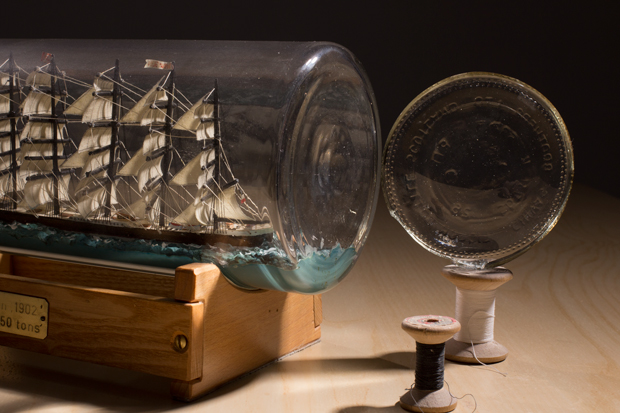
This screenshot has width=620, height=413. Find the location of `glass bottle`. glass bottle is located at coordinates (306, 78).